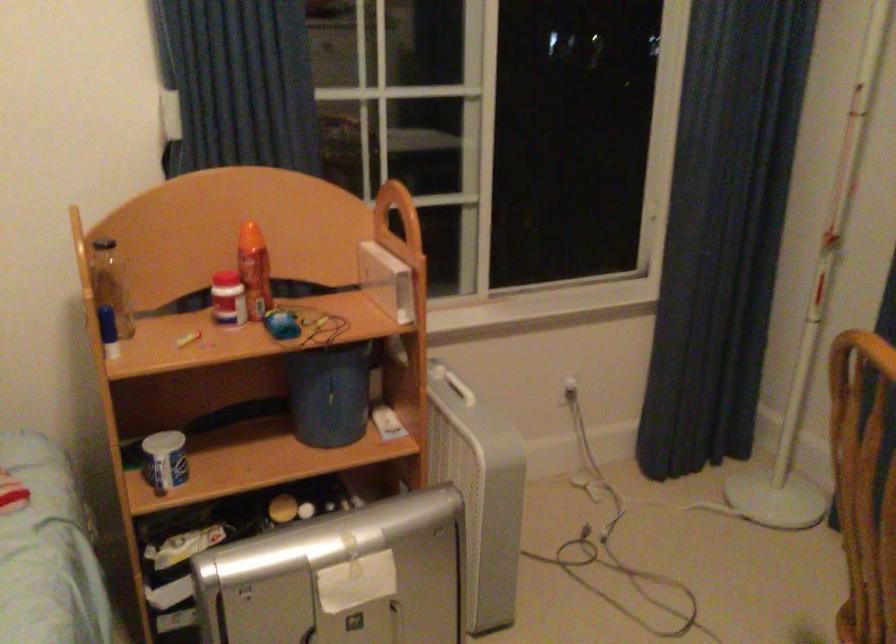
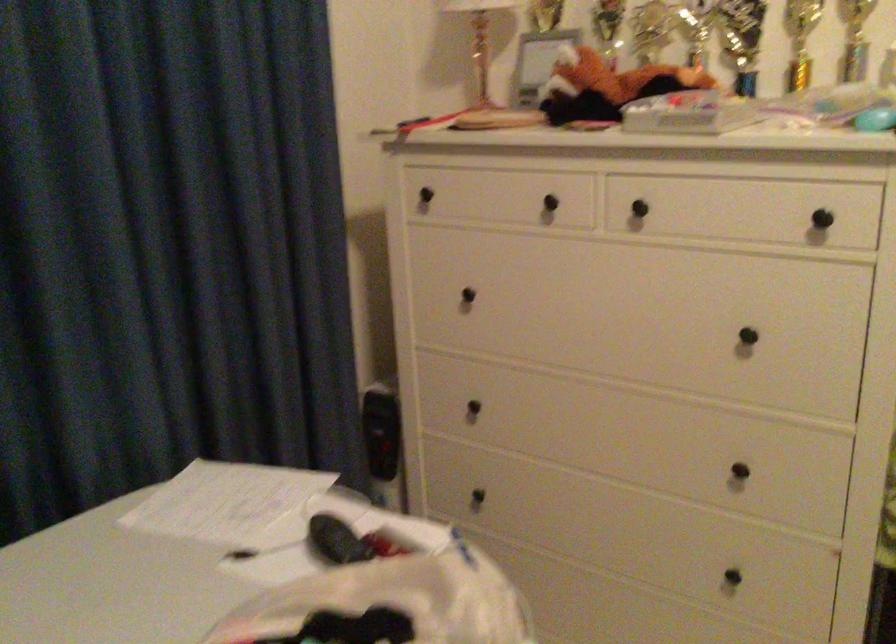
Based on the continuous images, in which direction is the camera rotating?

The camera rotated toward right-down.